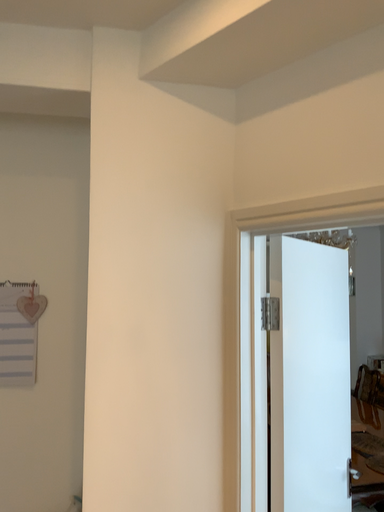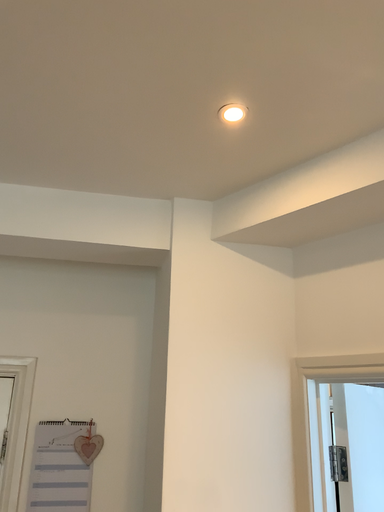
Question: How did the camera likely rotate when shooting the video?

Choices:
 (A) rotated upward
 (B) rotated downward

Answer: (A)